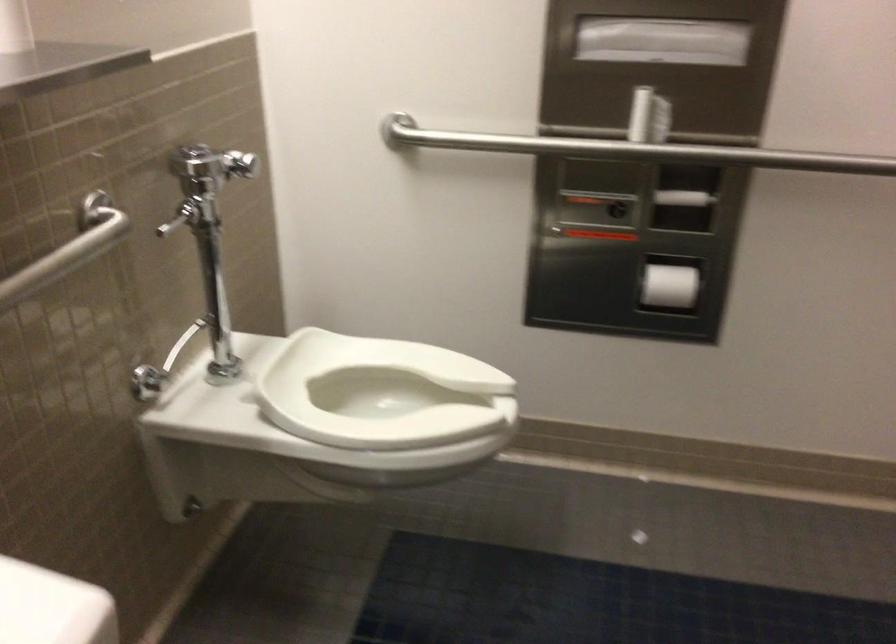
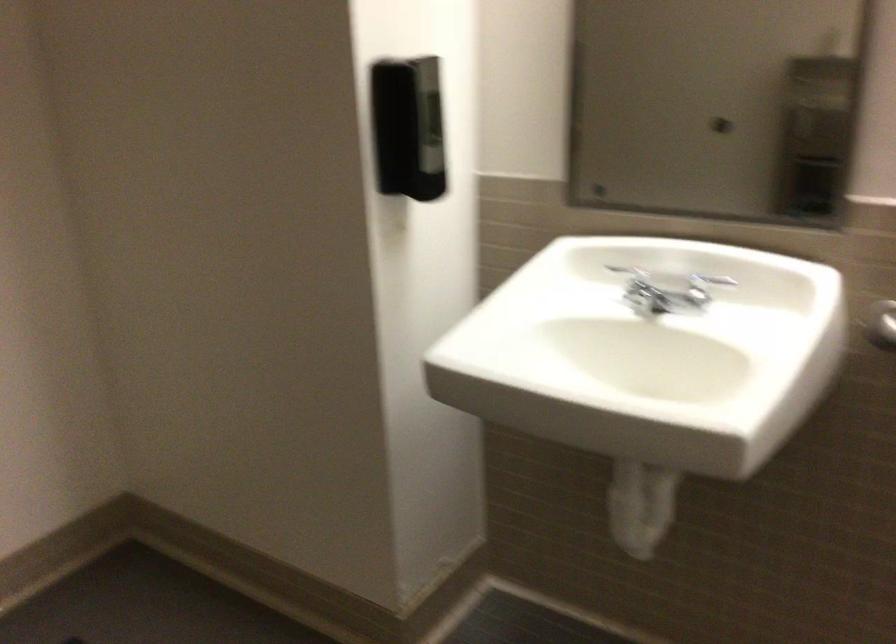
The images are taken continuously from a first-person perspective. In which direction is your viewpoint rotating?

The camera rotated toward left-down.